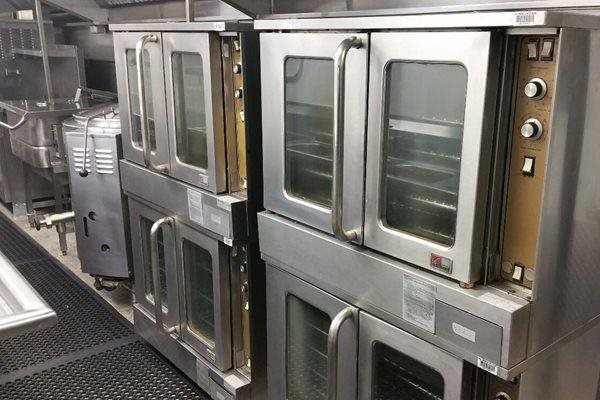
I want to click on paper with black text on it, so click(x=418, y=305).